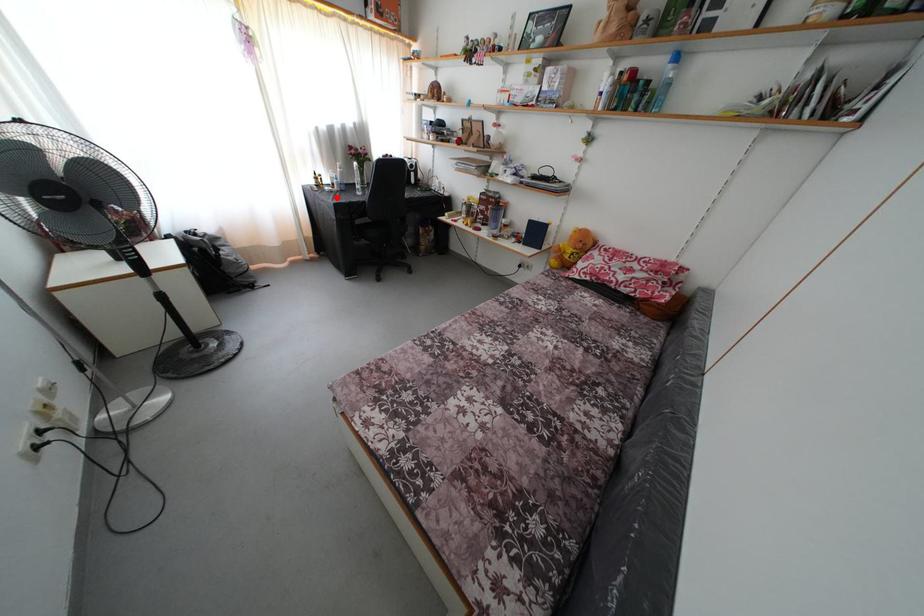
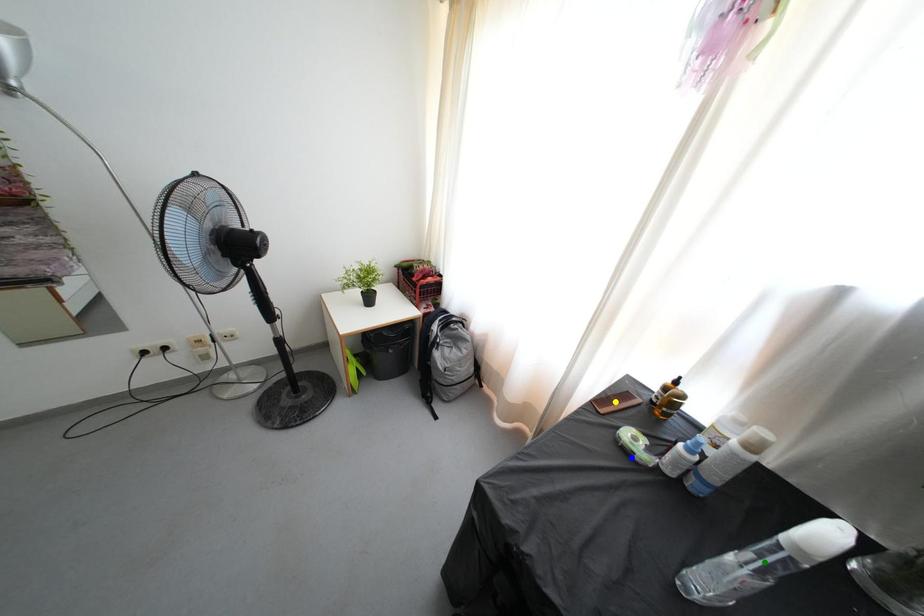
Question: I am providing you with two images of the same scene from different viewpoints. A red point is marked on the first image. You are given multiple points on the second image. Which spot in image 2 lines up with the point in image 1?

Choices:
 (A) yellow point
 (B) green point
 (C) blue point

Answer: (C)